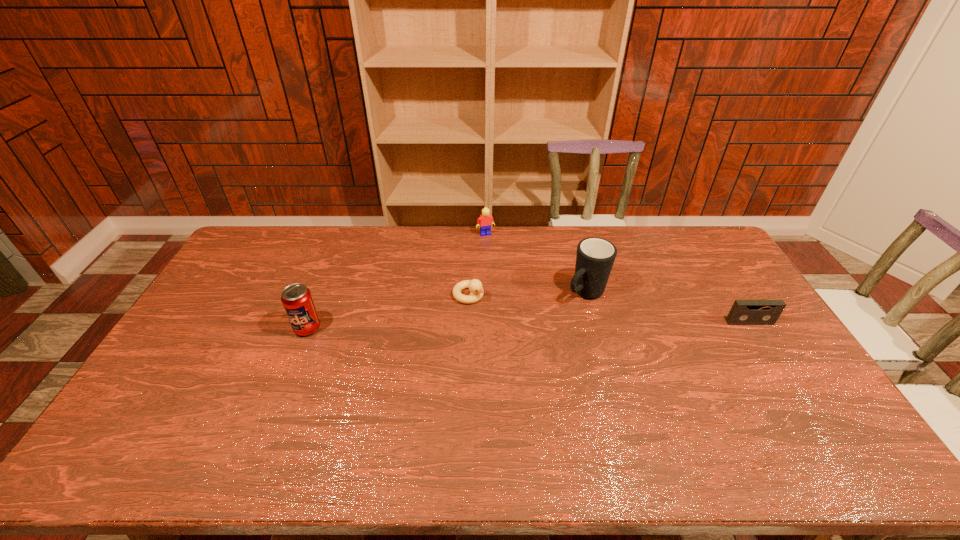
Image resolution: width=960 pixels, height=540 pixels. I want to click on blank region between the mug and the leftmost object, so click(x=446, y=310).

You are a GUI agent. You are given a task and a screenshot of the screen. Output one action in this format:
    pyautogui.click(x=<x>, y=<y>)
    Task: Click on the free space between the third tallest object and the duckling
    The image size is (960, 540).
    Given the screenshot: What is the action you would take?
    pyautogui.click(x=477, y=264)

Image resolution: width=960 pixels, height=540 pixels. I want to click on unoccupied area between the mug and the videotape, so click(667, 308).

The image size is (960, 540). Identify the location of free point between the duckling and the mug. (527, 294).

I want to click on vacant space that is in between the duckling and the farthest object, so click(477, 264).

Identify which object is the second nearest to the duckling. Please provide its 2D coordinates. Your answer should be formatted as a tuple, i.e. [(x, y)], where the tuple contains the x and y coordinates of a point satisfying the conditions above.

[(485, 220)]

You are a GUI agent. You are given a task and a screenshot of the screen. Output one action in this format:
    pyautogui.click(x=<x>, y=<y>)
    Task: Click on the closest object to the duckling
    The width and height of the screenshot is (960, 540).
    Given the screenshot: What is the action you would take?
    pyautogui.click(x=595, y=257)

Where is `vacant position in the image that satisfies the following two spatial constraints: 1. on the back side of the farthest object; 2. on the left side of the duckling`? The width and height of the screenshot is (960, 540). vacant position in the image that satisfies the following two spatial constraints: 1. on the back side of the farthest object; 2. on the left side of the duckling is located at coordinates (470, 234).

Find the location of a particular element. The width and height of the screenshot is (960, 540). free location that satisfies the following two spatial constraints: 1. on the back side of the second object from right to left; 2. on the left side of the soda can is located at coordinates 322,293.